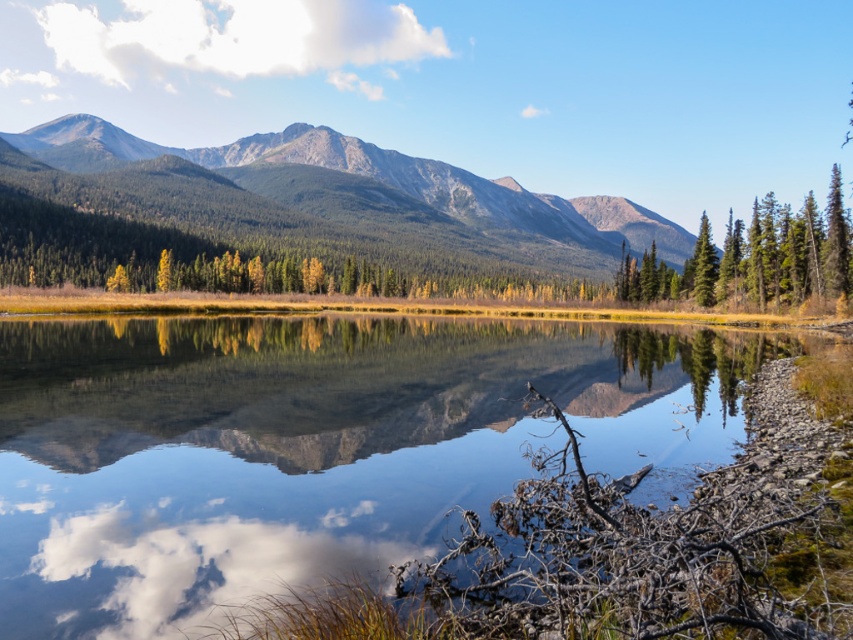
Is clear water at center positioned in front of green matte tree at upper right?

Yes.

Is clear water at center below green matte tree at upper right?

Correct, clear water at center is located below green matte tree at upper right.

Between point (38, 340) and point (778, 288), which one is positioned behind?

The point (778, 288) is behind.

This screenshot has width=853, height=640. What are the coordinates of `clear water at center` in the screenshot? It's located at (312, 445).

This screenshot has width=853, height=640. I want to click on clear water at center, so click(x=312, y=445).

Is clear water at center positioned at the back of white fluffy cloud at upper left?

No, clear water at center is closer to the viewer.

Who is more distant from viewer, (12, 371) or (184, 40)?

Point (184, 40)

You are a GUI agent. You are given a task and a screenshot of the screen. Output one action in this format:
    pyautogui.click(x=<x>, y=<y>)
    Task: Click on the clear water at center
    
    Given the screenshot: What is the action you would take?
    pyautogui.click(x=312, y=445)

Between green forested mountain range at upper left and green matte tree at upper right, which one has less height?

Standing shorter between the two is green matte tree at upper right.

Measure the distance from green forested mountain range at upper left to green matte tree at upper right.

They are 252.98 meters apart.

Is point (287, 138) behind point (767, 288)?

That is True.

You are a GUI agent. You are given a task and a screenshot of the screen. Output one action in this format:
    pyautogui.click(x=<x>, y=<y>)
    Task: Click on the green forested mountain range at upper left
    Image resolution: width=853 pixels, height=640 pixels.
    Given the screenshot: What is the action you would take?
    pyautogui.click(x=392, y=180)